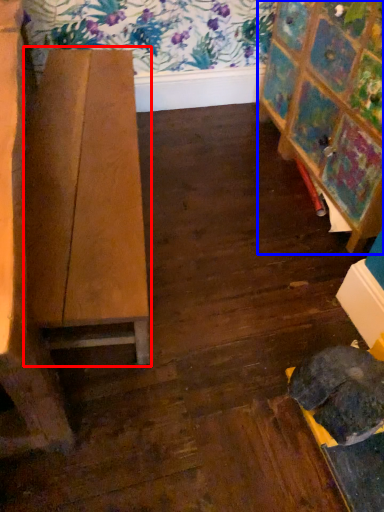
Question: Among these objects, which one is farthest to the camera, table (highlighted by a red box) or furniture (highlighted by a blue box)?

Choices:
 (A) table
 (B) furniture

Answer: (B)